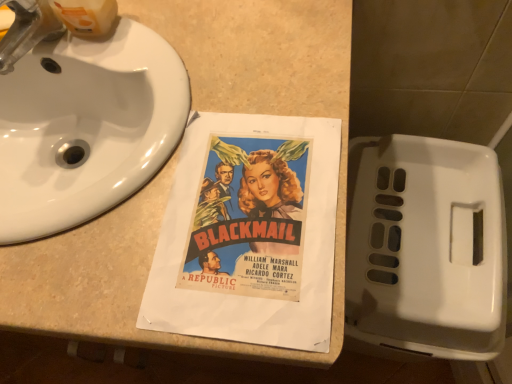
Where is `vacant space to the right of brushed metal faucet at upper left`? The width and height of the screenshot is (512, 384). vacant space to the right of brushed metal faucet at upper left is located at coordinates (148, 58).